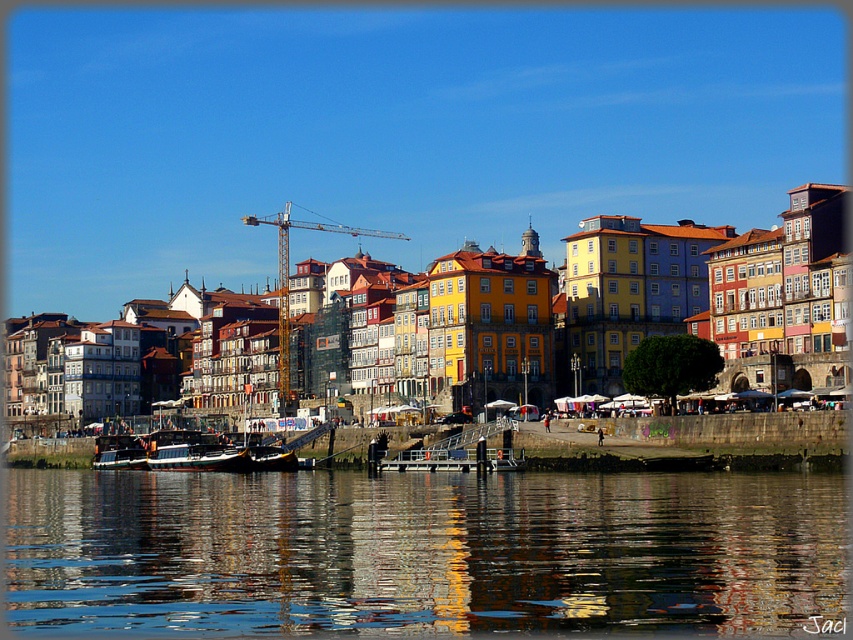
You are standing on the riverside promenade and notice the point marked at coordinates [422,552]. What is located at that point?

The point at coordinates [422,552] marks reflective glass water at lower center.

You are standing at the riverside and want to take a photo of the crane in the background. There are two points marked in the scene, point 1 at coordinates point (311, 484) and point 2 at coordinates point (94, 442). Which point should you avoid standing behind to ensure the crane is visible in your photo?

You should avoid standing behind point 2 at coordinates point (94, 442) because it is farther from the camera compared to point 1. Since point 1 is closer to the camera, standing behind it would block your view of the crane less effectively than standing behind point 2.